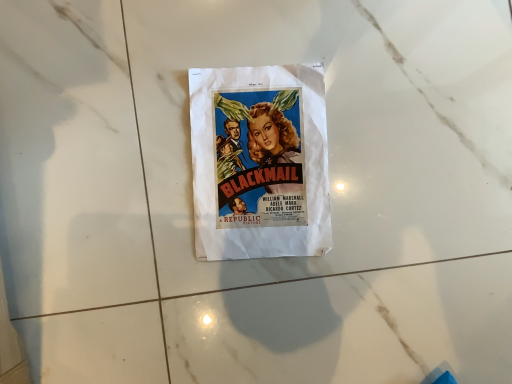
The height and width of the screenshot is (384, 512). Describe the element at coordinates (260, 162) in the screenshot. I see `matte paper poster at center` at that location.

Find the location of a particular element. matte paper poster at center is located at coordinates (260, 162).

Locate an element on the screen. This screenshot has height=384, width=512. matte paper poster at center is located at coordinates (260, 162).